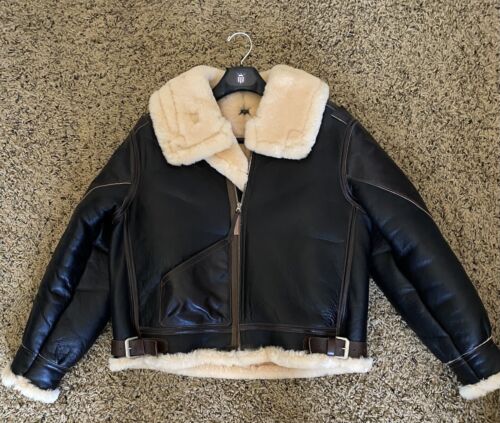
This screenshot has width=500, height=423. Identify the location of hanger. (243, 75).